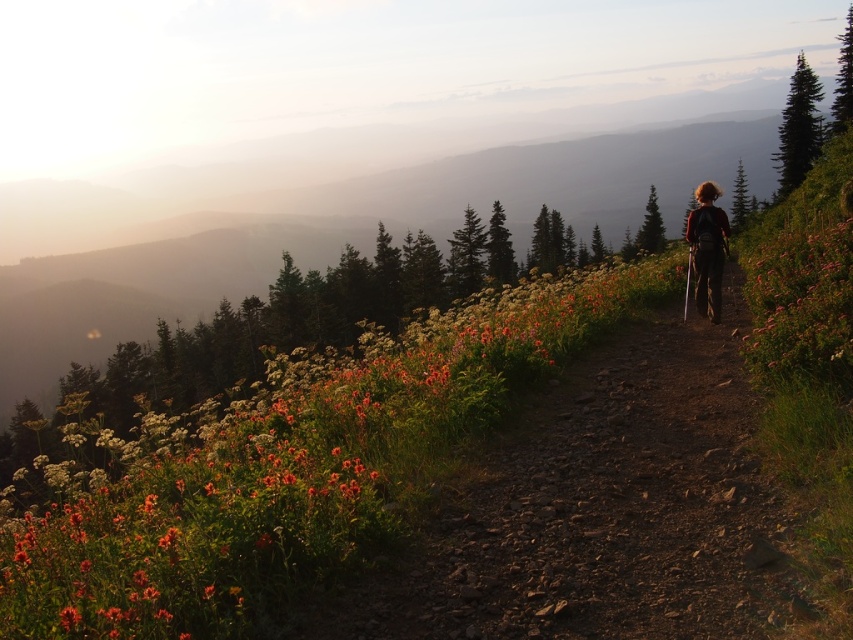
You are a hiker standing at the point labeled as point [601,509]. You want to continue walking along the dirt path at center. Which direction should you move to stay on the trail?

The dirt path at center is located at point [601,509], so moving along the direction of the dirt path at center will keep you on the trail.

You are a hiker planning to walk along the trail. You notice the dirt path at center and orange matte flowers at center. Which one is shorter in height?

The dirt path at center is shorter than orange matte flowers at center.